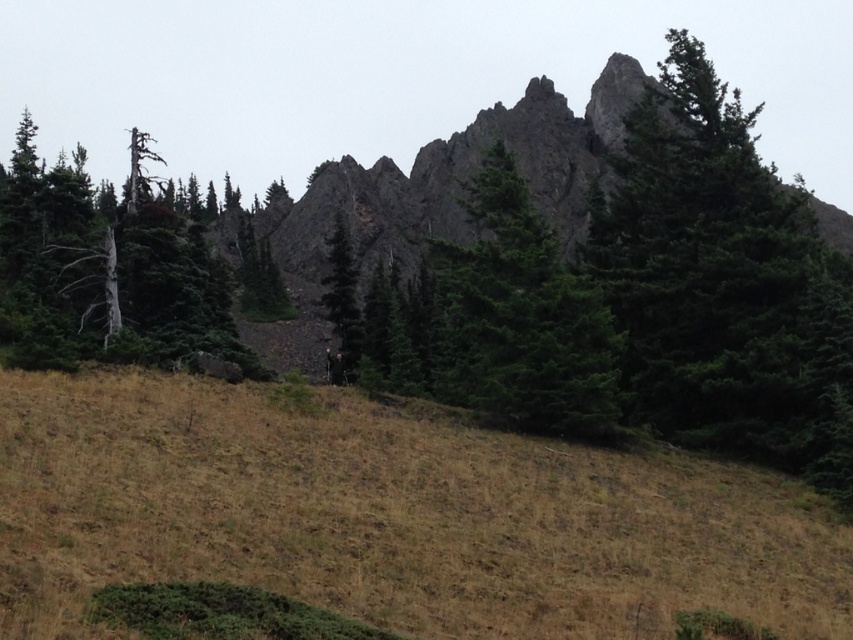
Question: Does dry grass at center have a greater width compared to green matte tree at center?

Choices:
 (A) no
 (B) yes

Answer: (B)

Question: Which object is positioned closest to the green matte tree at center?

Choices:
 (A) dry grass at center
 (B) dead wood tree at left
 (C) green matte tree at upper right

Answer: (C)

Question: Can you confirm if dry grass at center is smaller than dead wood tree at left?

Choices:
 (A) yes
 (B) no

Answer: (A)

Question: Can you confirm if dry grass at center is wider than dead wood tree at left?

Choices:
 (A) yes
 (B) no

Answer: (B)

Question: Which point is farther to the camera?

Choices:
 (A) (141, 182)
 (B) (700, 81)
 (C) (622, 476)
 (D) (343, 248)

Answer: (D)

Question: Which point is farther to the camera?

Choices:
 (A) dead wood tree at left
 (B) green matte tree at center
 (C) green matte tree at upper right
 (D) dry grass at center

Answer: (B)